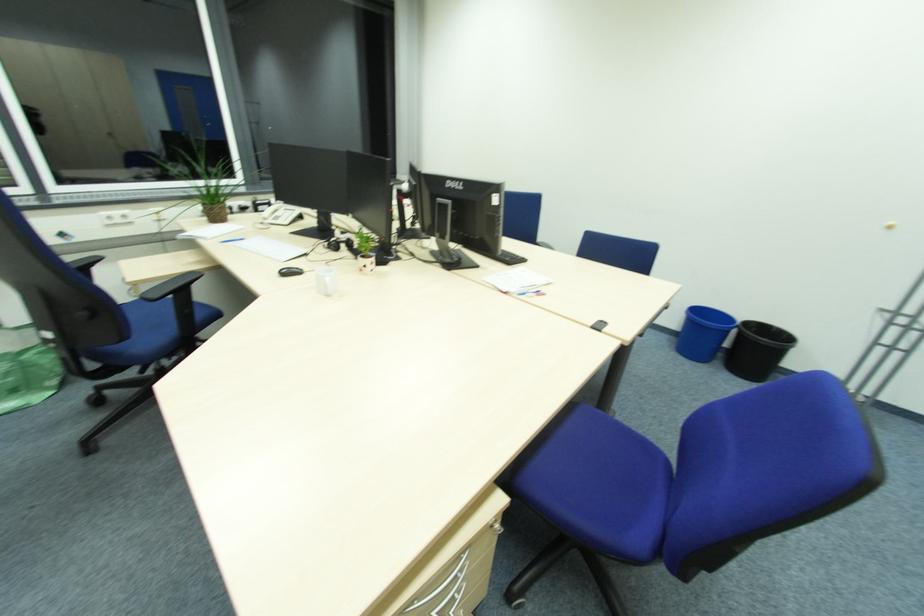
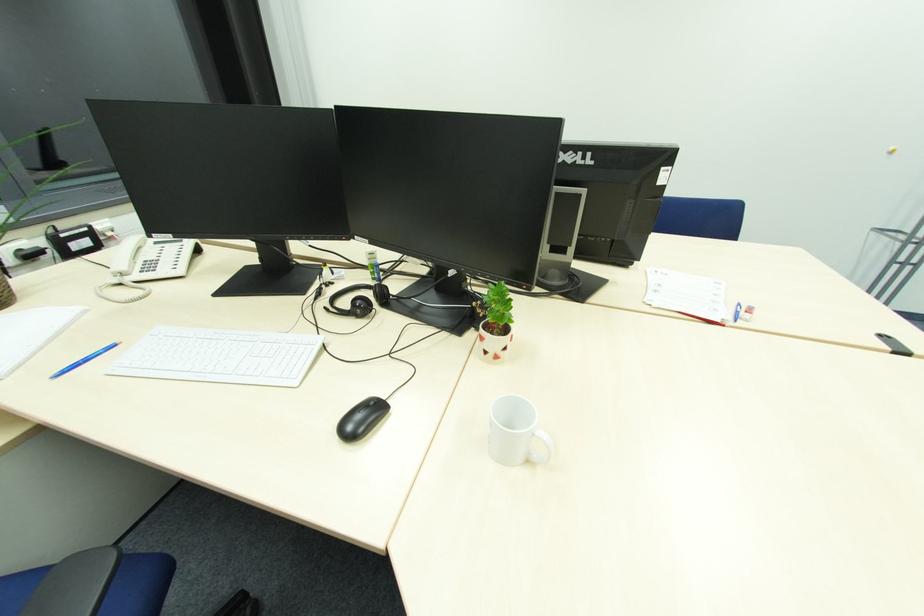
Which direction would the cameraman need to move to produce the second image?

The cameraman walked toward left, forward.